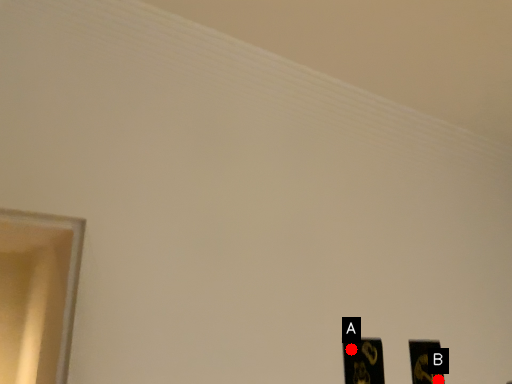
Question: Two points are circled on the image, labeled by A and B beside each circle. Among these points, which one is farthest from the camera?

Choices:
 (A) A is further
 (B) B is further

Answer: (B)